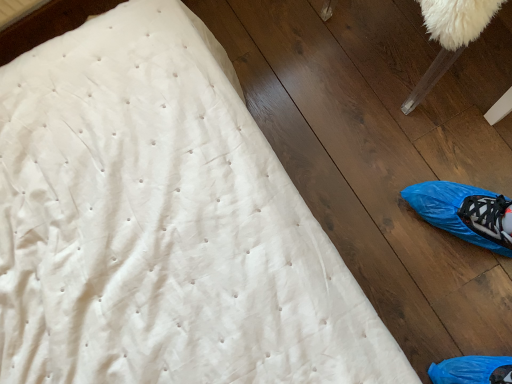
Where is `vacant area situated below white fluffy bean bag chair at upper right (from a real-world perspective)`? This screenshot has width=512, height=384. vacant area situated below white fluffy bean bag chair at upper right (from a real-world perspective) is located at coordinates (410, 48).